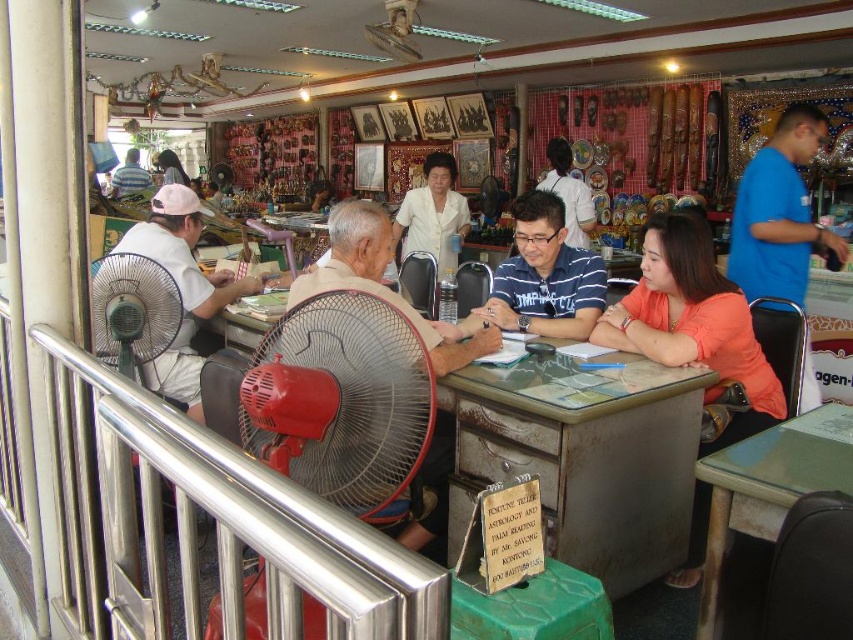
Question: Is red plastic fan at center smaller than green plastic fan at left?

Choices:
 (A) no
 (B) yes

Answer: (A)

Question: Among these objects, which one is farthest from the camera?

Choices:
 (A) white fabric shirt at left
 (B) orange matte shirt at center
 (C) matte blue shirt at left
 (D) green plastic fan at left

Answer: (C)

Question: Which object is positioned farthest from the red plastic fan at center?

Choices:
 (A) metallic gray desk at center
 (B) matte blue shirt at left

Answer: (B)

Question: Estimate the real-world distances between objects in this image. Which object is farther from the red plastic fan at center?

Choices:
 (A) matte black shirt at center
 (B) metallic gray desk at center
 (C) beige fabric shirt at center

Answer: (A)

Question: Where is blue striped polo shirt at center located in relation to white fabric shirt at left in the image?

Choices:
 (A) below
 (B) above

Answer: (B)

Question: Is metallic gray desk at center wider than blue striped polo shirt at center?

Choices:
 (A) yes
 (B) no

Answer: (A)